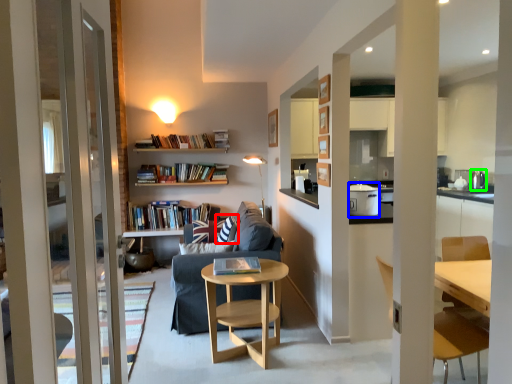
Question: Estimate the real-world distances between objects in this image. Which object is closer to pillow (highlighted by a red box), appliance (highlighted by a blue box) or appliance (highlighted by a green box)?

Choices:
 (A) appliance
 (B) appliance

Answer: (A)